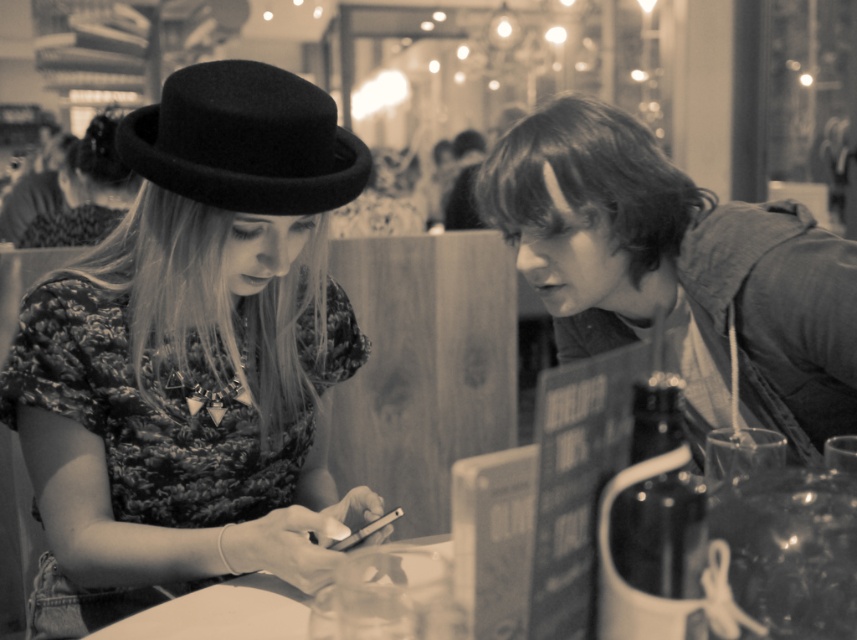
Who is higher up, matte black hat at upper left or white glossy table at center?

Positioned higher is matte black hat at upper left.

Is point (34, 186) farther from camera compared to point (262, 598)?

That is True.

Does point (90, 205) come farther from viewer compared to point (264, 600)?

Yes, point (90, 205) is behind point (264, 600).

This screenshot has width=857, height=640. What are the coordinates of `matte black hat at upper left` in the screenshot? It's located at [x=73, y=195].

Measure the distance between black felt fedora at upper left and camera.

black felt fedora at upper left is 1.04 meters away from camera.

Consider the image. Who is positioned more to the left, black felt fedora at upper left or matte black hat at upper left?

matte black hat at upper left is more to the left.

Locate an element on the screen. The width and height of the screenshot is (857, 640). black felt fedora at upper left is located at coordinates (x=244, y=141).

Who is positioned more to the right, matte black hat at left or white glossy table at center?

From the viewer's perspective, white glossy table at center appears more on the right side.

Which is below, matte black hat at left or white glossy table at center?

white glossy table at center

Describe the element at coordinates (193, 356) in the screenshot. I see `matte black hat at left` at that location.

Where is `matte black hat at left`? The width and height of the screenshot is (857, 640). matte black hat at left is located at coordinates (193, 356).